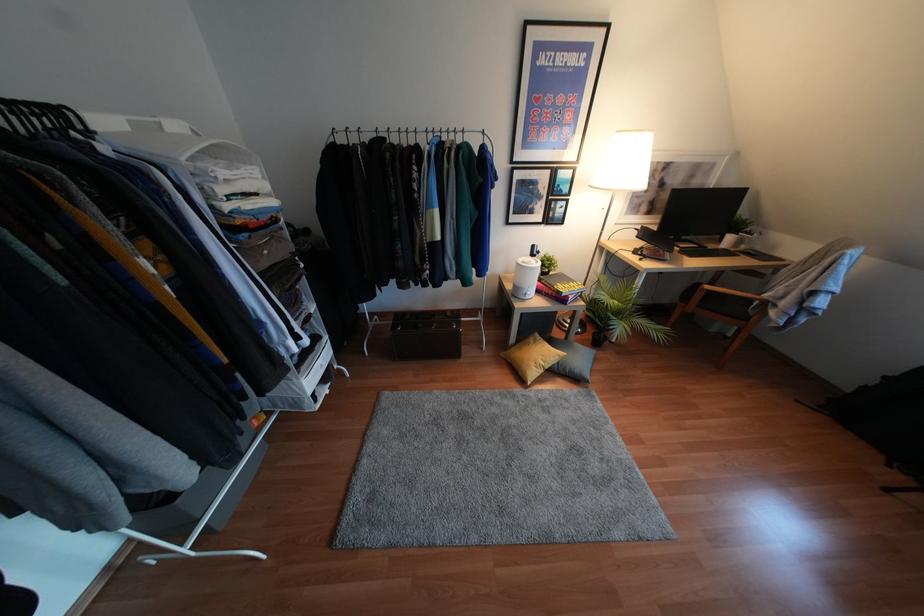
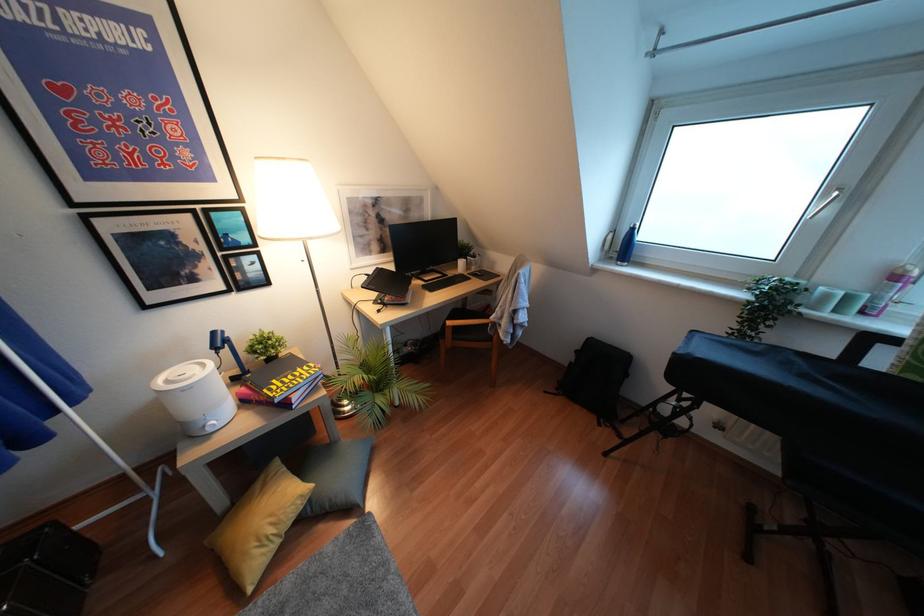
Where in the second image is the point corresponding to (526,297) from the first image?

(210, 430)